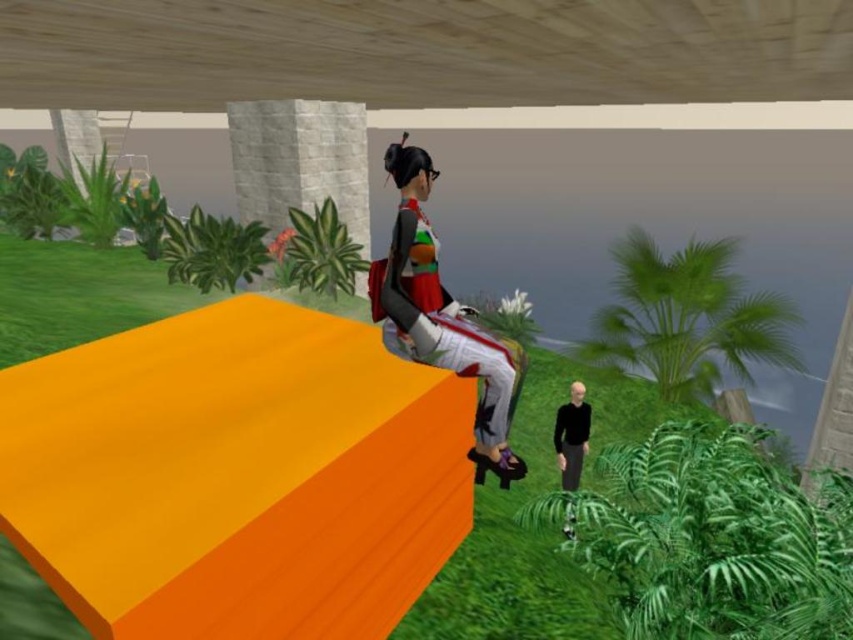
You are a character in the game and need to jump from the gray stone pillar at upper center to the black matte shirt at lower right. Can you make the jump without falling into the lava below?

The gray stone pillar at upper center is to the left of the black matte shirt at lower right, so you can jump from the gray stone pillar at upper center to the black matte shirt at lower right safely.

You are standing at the point labeled point (291, 157) in a virtual environment. You want to move to the location where the other character is standing, which is 9.34 meters away from you. If your maximum jump height is 2 meters, can you reach the other character without any obstacles?

The point labeled point (291, 157) is 9.34 meters away from the viewer. Since your maximum jump height is 2 meters, you can reach the other character as long as there are no obstacles in between, because the distance is horizontal and your jump height only affects vertical clearance.

Looking at this image, you are a game designer analyzing the character models in this scene. The game requires that all characters must be within a certain height range for gameplay balance. Given that the matte fabric outfit at center and the black matte shirt at lower right are both playable characters, which character would you adjust to meet the height requirements?

The matte fabric outfit at center is much taller than the black matte shirt at lower right, so you should adjust the height of the matte fabric outfit at center to reduce its height to ensure it meets the required range.